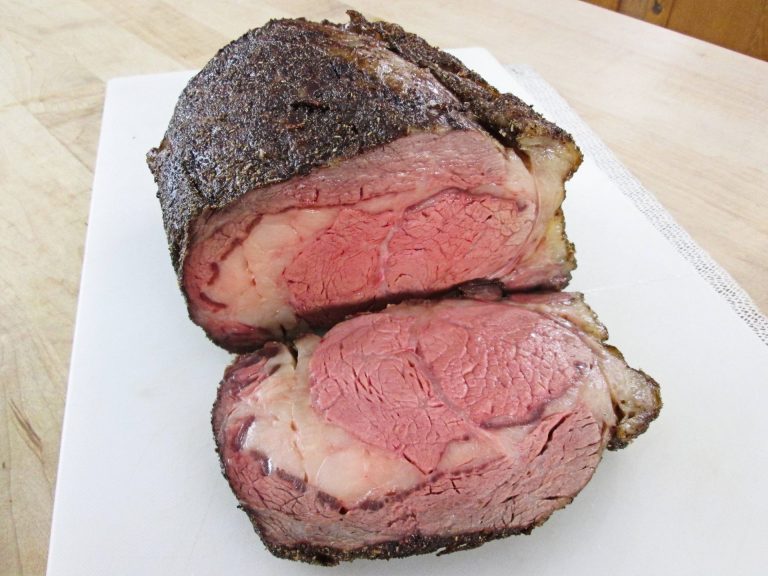
At what (x,y) coordinates should I click in order to perform the action: click on brown panel. Please return your answer as a coordinate pair (x, y). The width and height of the screenshot is (768, 576). Looking at the image, I should click on (687, 17).